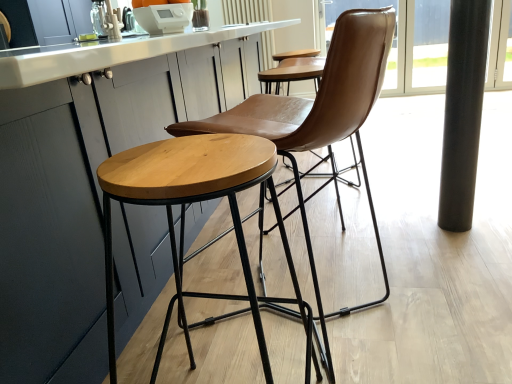
This screenshot has width=512, height=384. Identify the location of black glass window screen at right. (409, 43).

What do you see at coordinates (463, 111) in the screenshot?
I see `black polished pole at right` at bounding box center [463, 111].

Describe the element at coordinates (320, 109) in the screenshot. I see `brown leather chair at center` at that location.

You are a GUI agent. You are given a task and a screenshot of the screen. Output one action in this format:
    pyautogui.click(x=<x>, y=<y>)
    Task: Click on the white glossy countertop at center
    
    Given the screenshot: What is the action you would take?
    pyautogui.click(x=85, y=181)

You are a GUI agent. You are given a task and a screenshot of the screen. Output one action in this format:
    pyautogui.click(x=<x>, y=<y>)
    Task: Click on the black glass window screen at right
    Image resolution: width=512 pixels, height=384 pixels.
    Given the screenshot: What is the action you would take?
    pyautogui.click(x=409, y=43)

From the image's perspective, which object appears higher, brown leather chair at center or black glass window screen at right?

black glass window screen at right is shown above in the image.

In the scene shown: Is brown leather chair at center to the left of black glass window screen at right from the viewer's perspective?

Correct, you'll find brown leather chair at center to the left of black glass window screen at right.

Considering the relative positions of brown leather chair at center and black glass window screen at right in the image provided, is brown leather chair at center behind black glass window screen at right?

No, it is not.

From a real-world perspective, which object rests below the other?

From a 3D spatial view, white glossy countertop at center is below.

At what (x,y) coordinates should I click in order to perform the action: click on window screen above the white glossy countertop at center (from a real-world perspective). Please return your answer as a coordinate pair (x, y). This screenshot has width=512, height=384. Looking at the image, I should click on (409, 43).

Considering the sizes of white glossy countertop at center and black glass window screen at right in the image, is white glossy countertop at center bigger or smaller than black glass window screen at right?

In the image, white glossy countertop at center appears to be larger than black glass window screen at right.

From the image's perspective, would you say white glossy countertop at center is shown under black glass window screen at right?

Yes, from the image's perspective, white glossy countertop at center is beneath black glass window screen at right.

Would you say black polished pole at right is outside white glossy countertop at center?

Absolutely, black polished pole at right is external to white glossy countertop at center.

In terms of width, does black polished pole at right look wider or thinner when compared to white glossy countertop at center?

Considering their sizes, black polished pole at right looks slimmer than white glossy countertop at center.

Considering the relative positions of black polished pole at right and white glossy countertop at center in the image provided, is black polished pole at right to the left or to the right of white glossy countertop at center?

Based on their positions, black polished pole at right is located to the right of white glossy countertop at center.

From the image's perspective, which is below, black polished pole at right or white glossy countertop at center?

black polished pole at right, from the image's perspective.

Which object is more forward, black glass window screen at right or black polished pole at right?

black polished pole at right is more forward.

Does black glass window screen at right touch black polished pole at right?

No, black glass window screen at right is not beside black polished pole at right.

Is black polished pole at right surrounded by black glass window screen at right?

No.

Is black glass window screen at right located within black polished pole at right?

Definitely not — black glass window screen at right is not inside black polished pole at right.

Is black polished pole at right facing away from black glass window screen at right?

No, black glass window screen at right is not at the back of black polished pole at right.

The image size is (512, 384). In order to click on window screen behind the black polished pole at right in this screenshot , I will do `click(409, 43)`.

From the image's perspective, is white glossy countertop at center located beneath brown leather chair at center?

No, from the image's perspective, white glossy countertop at center is not below brown leather chair at center.

Can you tell me how much white glossy countertop at center and brown leather chair at center differ in facing direction?

The facing directions of white glossy countertop at center and brown leather chair at center are 173 degrees apart.

Is white glossy countertop at center oriented towards brown leather chair at center?

Yes, white glossy countertop at center is aimed at brown leather chair at center.

Would you say brown leather chair at center is part of white glossy countertop at center's contents?

No, brown leather chair at center is not a part of white glossy countertop at center.

Which object is positioned more to the right, white glossy countertop at center or black polished pole at right?

black polished pole at right.

From a real-world perspective, which object rests below the other?

black polished pole at right is physically lower.

From the image's perspective, is white glossy countertop at center on black polished pole at right?

Yes, from the image's perspective, white glossy countertop at center is over black polished pole at right.

Is white glossy countertop at center positioned with its back to black polished pole at right?

Yes.

Identify the location of chair in front of the black glass window screen at right. The height and width of the screenshot is (384, 512). (320, 109).

In the image, there is a black glass window screen at right. Identify the location of counter top below it (from a real-world perspective). The width and height of the screenshot is (512, 384). (85, 181).

Considering their positions, is white glossy countertop at center positioned further to brown leather chair at center than black polished pole at right?

black polished pole at right lies further to brown leather chair at center than the other object.

From the image, which object appears to be farther from brown leather chair at center, black glass window screen at right or white glossy countertop at center?

Among the two, black glass window screen at right is located further to brown leather chair at center.

Which object lies nearer to the anchor point white glossy countertop at center, brown leather chair at center or black glass window screen at right?

The object closer to white glossy countertop at center is brown leather chair at center.

Looking at the image, which one is located further to black polished pole at right, white glossy countertop at center or brown leather chair at center?

Based on the image, white glossy countertop at center appears to be further to black polished pole at right.

Estimate the real-world distances between objects in this image. Which object is closer to black glass window screen at right, brown leather chair at center or black polished pole at right?

Based on the image, black polished pole at right appears to be nearer to black glass window screen at right.

From the image, which object appears to be farther from black polished pole at right, white glossy countertop at center or black glass window screen at right?

Among the two, black glass window screen at right is located further to black polished pole at right.

Based on their spatial positions, is brown leather chair at center or white glossy countertop at center further from black glass window screen at right?

Based on the image, brown leather chair at center appears to be further to black glass window screen at right.

Considering their positions, is black polished pole at right positioned closer to black glass window screen at right than brown leather chair at center?

black polished pole at right is closer to black glass window screen at right.

Image resolution: width=512 pixels, height=384 pixels. I want to click on chair between white glossy countertop at center and black polished pole at right from left to right, so click(320, 109).

Locate an element on the screen. The image size is (512, 384). pillar between brown leather chair at center and black glass window screen at right from front to back is located at coordinates (463, 111).

The height and width of the screenshot is (384, 512). I want to click on pillar between white glossy countertop at center and black glass window screen at right in the front-back direction, so click(463, 111).

The height and width of the screenshot is (384, 512). Identify the location of chair between white glossy countertop at center and black glass window screen at right from front to back. (320, 109).